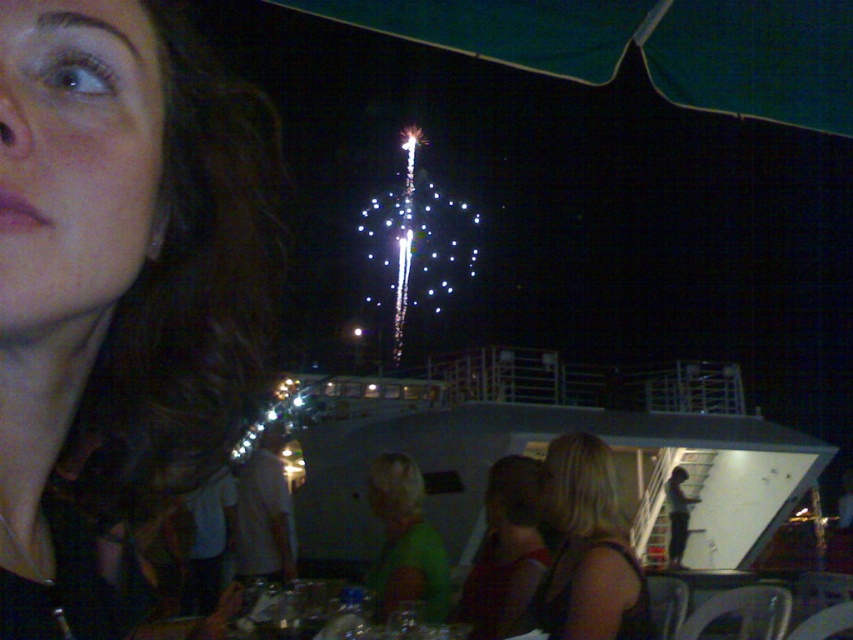
Question: Among these objects, which one is nearest to the camera?

Choices:
 (A) blonde hair at lower right
 (B) matte black hair at upper left

Answer: (B)

Question: Where is matte black hair at upper left located in relation to blonde hair at lower right in the image?

Choices:
 (A) above
 (B) below

Answer: (A)

Question: Does matte black hair at upper left have a greater width compared to blonde hair at lower right?

Choices:
 (A) yes
 (B) no

Answer: (B)

Question: From the image, what is the correct spatial relationship of matte black hair at upper left in relation to blonde hair at lower right?

Choices:
 (A) left
 (B) right

Answer: (A)

Question: Which object appears closest to the camera in this image?

Choices:
 (A) blonde hair at lower right
 (B) matte black hair at upper left

Answer: (B)

Question: Which object is closer to the camera taking this photo?

Choices:
 (A) blonde hair at lower right
 (B) matte black hair at upper left

Answer: (B)